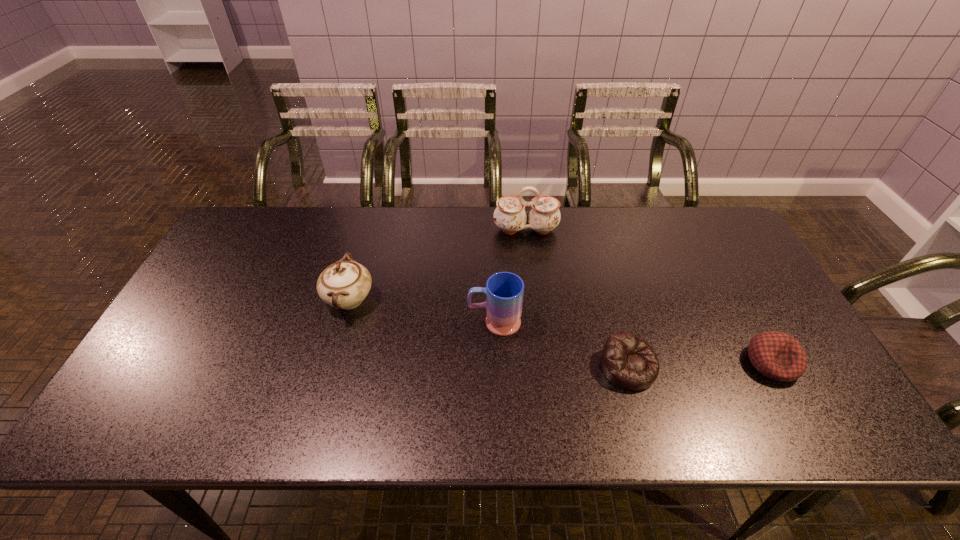
You are a GUI agent. You are given a task and a screenshot of the screen. Output one action in this format:
    pyautogui.click(x=<x>, y=<y>)
    Task: Click on the free space located 0.370m on the side of the mug with the handle
    The image size is (960, 540).
    Given the screenshot: What is the action you would take?
    pyautogui.click(x=329, y=322)

The image size is (960, 540). Identify the location of vacant space positioned 0.160m on the side of the mug with the handle. (408, 322).

Locate an element on the screen. blank space located 0.290m on the left of the right beanbag is located at coordinates (629, 363).

Identify the location of vacant space located on the right of the left beanbag. (755, 367).

You are a GUI agent. You are given a task and a screenshot of the screen. Output one action in this format:
    pyautogui.click(x=<x>, y=<y>)
    Task: Click on the object that is at the far edge
    The width and height of the screenshot is (960, 540).
    Given the screenshot: What is the action you would take?
    pyautogui.click(x=510, y=216)

Image resolution: width=960 pixels, height=540 pixels. I want to click on object situated at the right edge, so click(778, 356).

Locate an element on the screen. This screenshot has height=540, width=960. vacant space at the far edge of the desktop is located at coordinates (365, 211).

At what (x,y) coordinates should I click in order to perform the action: click on vacant region at the near edge of the desktop. Please return your answer as a coordinate pair (x, y). Looking at the image, I should click on (453, 431).

In the image, there is a desktop. Where is `free space at the left edge`? The image size is (960, 540). free space at the left edge is located at coordinates (212, 326).

Locate an element on the screen. The height and width of the screenshot is (540, 960). vacant area at the right edge is located at coordinates (758, 278).